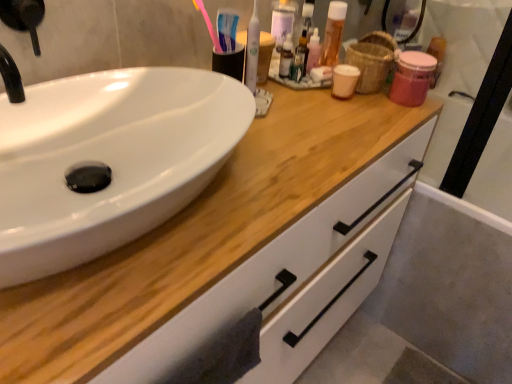
Question: Is white plastic toothbrush at upper center, which ranks as the second mouthwash in back-to-front order, shorter than translucent plastic mouthwash at upper center, which is counted as the first mouthwash, starting from the right?

Choices:
 (A) no
 (B) yes

Answer: (A)

Question: Considering the relative sizes of white plastic toothbrush at upper center, the first mouthwash positioned from the front, and translucent plastic mouthwash at upper center, which is counted as the second mouthwash, starting from the front, in the image provided, is white plastic toothbrush at upper center, the first mouthwash positioned from the front, thinner than translucent plastic mouthwash at upper center, which is counted as the second mouthwash, starting from the front,?

Choices:
 (A) no
 (B) yes

Answer: (B)

Question: From the image's perspective, does white plastic toothbrush at upper center, which ranks as the second mouthwash in back-to-front order, appear lower than translucent plastic mouthwash at upper center, which is counted as the first mouthwash, starting from the right?

Choices:
 (A) no
 (B) yes

Answer: (B)

Question: Can you confirm if white plastic toothbrush at upper center, the first mouthwash positioned from the front, is positioned to the left of translucent plastic mouthwash at upper center, which is the 2th mouthwash in left-to-right order?

Choices:
 (A) no
 (B) yes

Answer: (B)

Question: Is white plastic toothbrush at upper center, the 1th mouthwash from the left, located outside translucent plastic mouthwash at upper center, which is counted as the second mouthwash, starting from the front?

Choices:
 (A) no
 (B) yes

Answer: (B)

Question: Which is correct: white plastic toothbrush at upper center, the first mouthwash positioned from the front, is inside translucent plastic mouthwash at upper center, positioned as the 1th mouthwash in back-to-front order, or outside of it?

Choices:
 (A) outside
 (B) inside

Answer: (A)

Question: From a real-world perspective, is white plastic toothbrush at upper center, which ranks as the second mouthwash in back-to-front order, physically located above or below translucent plastic mouthwash at upper center, which is the 2th mouthwash in left-to-right order?

Choices:
 (A) below
 (B) above

Answer: (B)

Question: In the image, is white plastic toothbrush at upper center, which appears as the second mouthwash when viewed from the right, on the left side or the right side of translucent plastic mouthwash at upper center, which is the 2th mouthwash in left-to-right order?

Choices:
 (A) left
 (B) right

Answer: (A)

Question: Considering the positions of white plastic toothbrush at upper center, the 1th mouthwash from the left, and translucent plastic mouthwash at upper center, which is counted as the second mouthwash, starting from the front, in the image, is white plastic toothbrush at upper center, the 1th mouthwash from the left, taller or shorter than translucent plastic mouthwash at upper center, which is counted as the second mouthwash, starting from the front,?

Choices:
 (A) tall
 (B) short

Answer: (A)

Question: In terms of size, does wooden cabinet at center appear bigger or smaller than white glossy sink at left?

Choices:
 (A) small
 (B) big

Answer: (B)

Question: Which is correct: wooden cabinet at center is inside white glossy sink at left, or outside of it?

Choices:
 (A) inside
 (B) outside

Answer: (B)

Question: Looking at their shapes, would you say wooden cabinet at center is wider or thinner than white glossy sink at left?

Choices:
 (A) thin
 (B) wide

Answer: (B)

Question: Visually, is wooden cabinet at center positioned to the left or to the right of white glossy sink at left?

Choices:
 (A) right
 (B) left

Answer: (A)

Question: Is pink plastic toothbrush at upper center situated inside wooden cabinet at center or outside?

Choices:
 (A) outside
 (B) inside

Answer: (A)

Question: Is pink plastic toothbrush at upper center to the left or to the right of wooden cabinet at center in the image?

Choices:
 (A) left
 (B) right

Answer: (A)